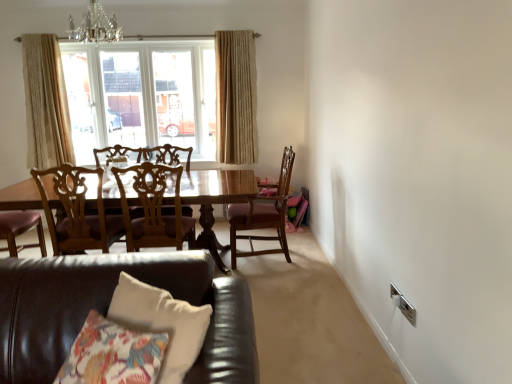
Question: Is beige textured curtain at left, positioned as the second curtain in right-to-left order, taller or shorter than leather couch at lower left?

Choices:
 (A) short
 (B) tall

Answer: (B)

Question: In the image, is beige textured curtain at left, positioned as the second curtain in right-to-left order, on the left side or the right side of leather couch at lower left?

Choices:
 (A) left
 (B) right

Answer: (A)

Question: Which is farther from the wooden chair with carved backrest at center, the first chair from the left?

Choices:
 (A) leather couch at lower left
 (B) wooden chair at center, which appears as the 3th chair when viewed from the left
 (C) crystal glass chandelier at upper center
 (D) clear glass window at upper center
 (E) beige textured curtain at left, positioned as the second curtain in right-to-left order

Answer: (D)

Question: Which of these objects is positioned closest to the crystal glass chandelier at upper center?

Choices:
 (A) clear glass window at upper center
 (B) wooden chair at center, which appears as the 3th chair when viewed from the left
 (C) beige textured curtain at left, arranged as the 1th curtain when viewed from the left
 (D) wooden chair at center, positioned as the 2th chair in left-to-right order
 (E) leather couch at lower left

Answer: (C)